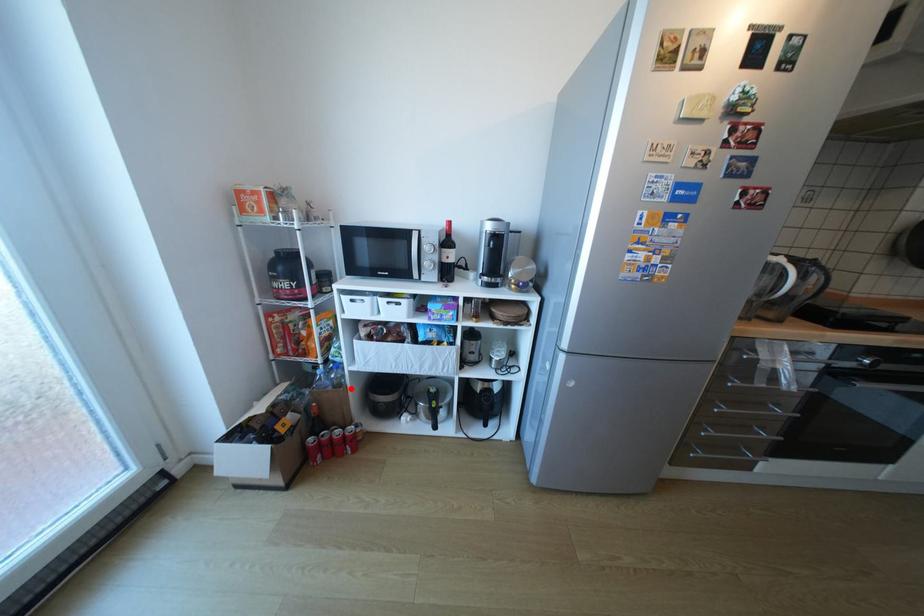
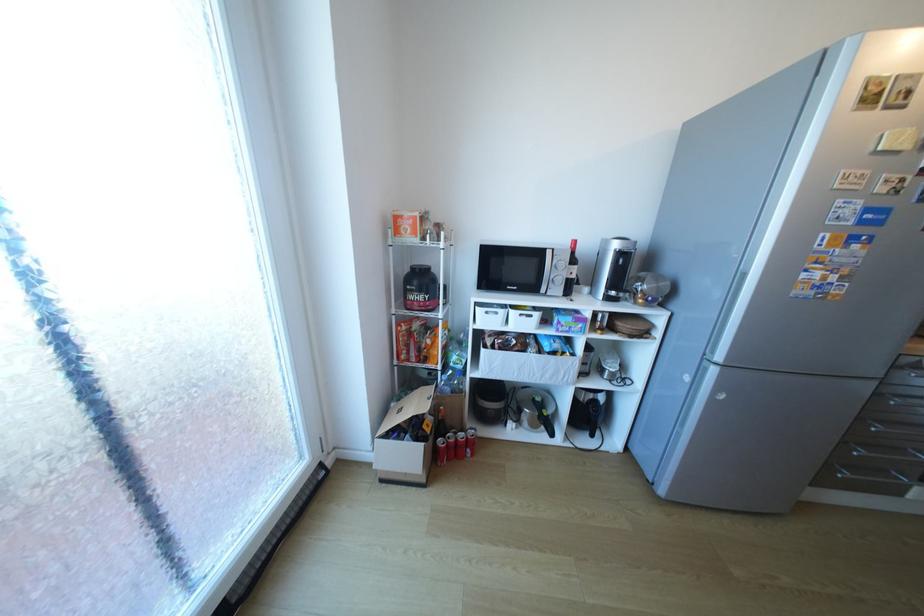
Where in the second image is the point corresponding to the highlighted location from the first image?

(472, 394)